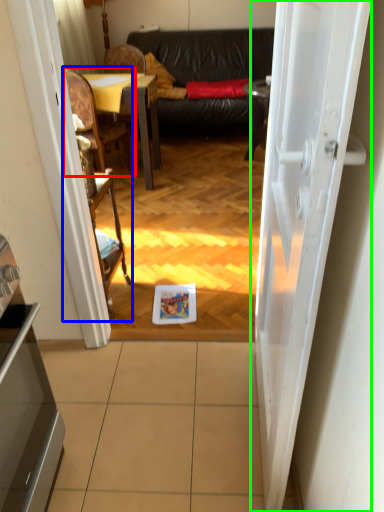
Question: Which is nearer to the chair (highlighted by a red box)? armchair (highlighted by a blue box) or door (highlighted by a green box).

Choices:
 (A) armchair
 (B) door

Answer: (A)